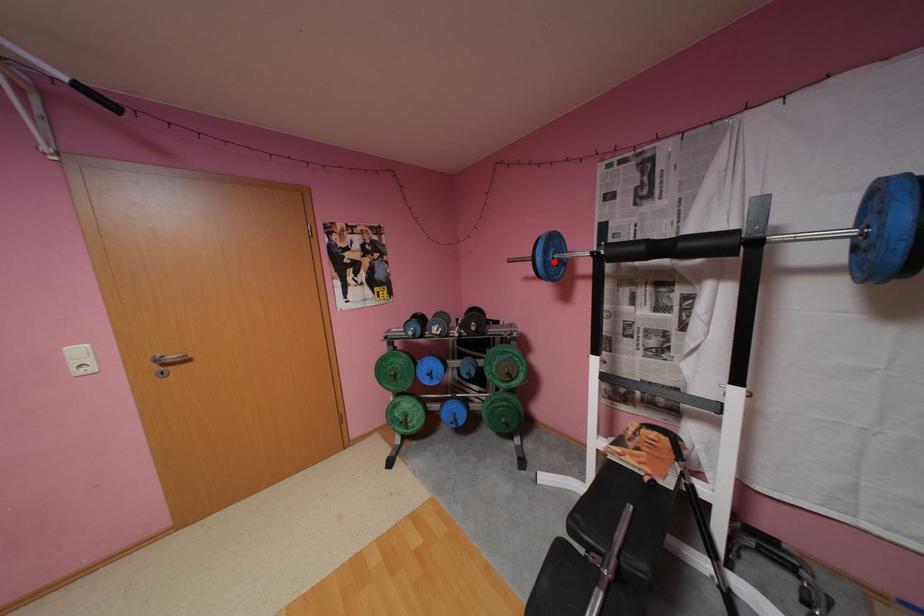
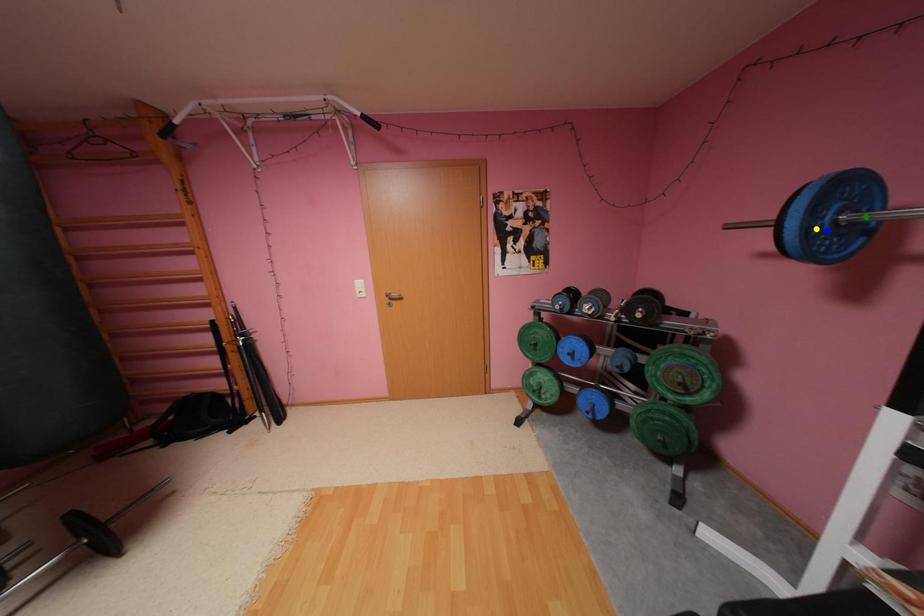
Question: I am providing you with two images of the same scene from different viewpoints. A red point is marked on the first image. You are given multiple points on the second image. In image 2, which mark is for the same physical point as the one in image 1?

Choices:
 (A) green point
 (B) yellow point
 (C) blue point

Answer: (B)